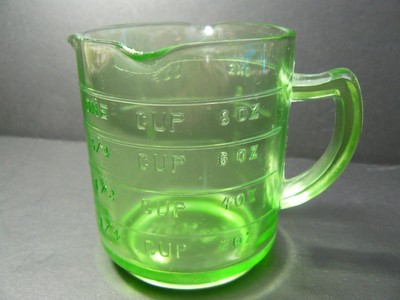
In order to click on measuring lines on cup in this screenshot , I will do `click(200, 108)`, `click(198, 138)`, `click(201, 194)`, `click(202, 232)`.